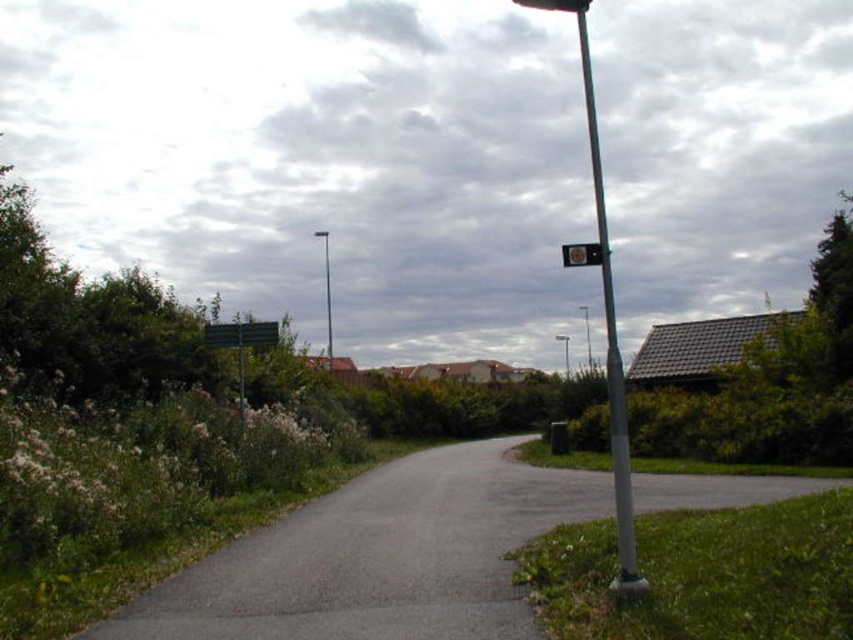
Question: Which point is closer to the camera taking this photo?

Choices:
 (A) (612, 380)
 (B) (589, 362)
 (C) (325, 248)
 (D) (592, 243)

Answer: (A)

Question: Estimate the real-world distances between objects in this image. Which object is closer to the silver metallic pole at right?

Choices:
 (A) asphalt road at center
 (B) metallic pole at right
 (C) metallic pole at center-right

Answer: (A)

Question: In this image, where is asphalt road at center located relative to silver metallic pole at right?

Choices:
 (A) above
 (B) below

Answer: (B)

Question: Does silver metallic pole at right have a greater width compared to metallic rectangular sign at upper center?

Choices:
 (A) yes
 (B) no

Answer: (A)

Question: Among these points, which one is nearest to the camera?

Choices:
 (A) (585, 342)
 (B) (581, 259)
 (C) (325, 291)

Answer: (B)

Question: From the image, what is the correct spatial relationship of metallic pole at center in relation to metallic pole at center-right?

Choices:
 (A) above
 (B) below

Answer: (A)